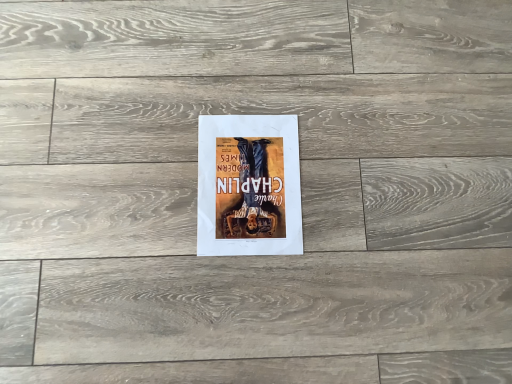
Consider the image. In order to face matte paper poster at center, should I rotate leftwards or rightwards?

To face it directly, rotate left by 0.794 degrees.

Describe the element at coordinates (249, 185) in the screenshot. The image size is (512, 384). I see `matte paper poster at center` at that location.

This screenshot has width=512, height=384. I want to click on matte paper poster at center, so click(249, 185).

Image resolution: width=512 pixels, height=384 pixels. What are the coordinates of `matte paper poster at center` in the screenshot? It's located at (249, 185).